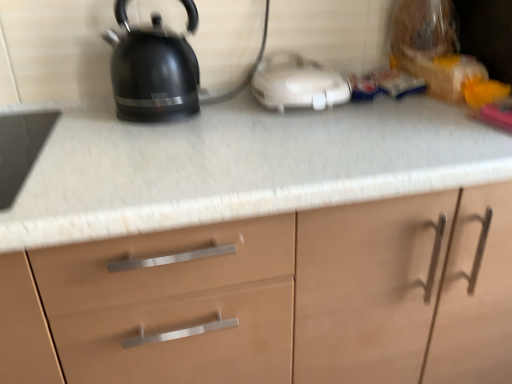
Question: From the image's perspective, is white plastic toaster at center positioned above or below matte wood cabinet at center?

Choices:
 (A) below
 (B) above

Answer: (B)

Question: Is white plastic toaster at center to the left or to the right of matte wood cabinet at center in the image?

Choices:
 (A) right
 (B) left

Answer: (A)

Question: Which object is the farthest from the white plastic toaster at center?

Choices:
 (A) matte wood cabinet at center
 (B) black glossy kettle at upper left

Answer: (A)

Question: Which object is positioned closest to the black glossy kettle at upper left?

Choices:
 (A) matte wood cabinet at center
 (B) white plastic toaster at center

Answer: (B)